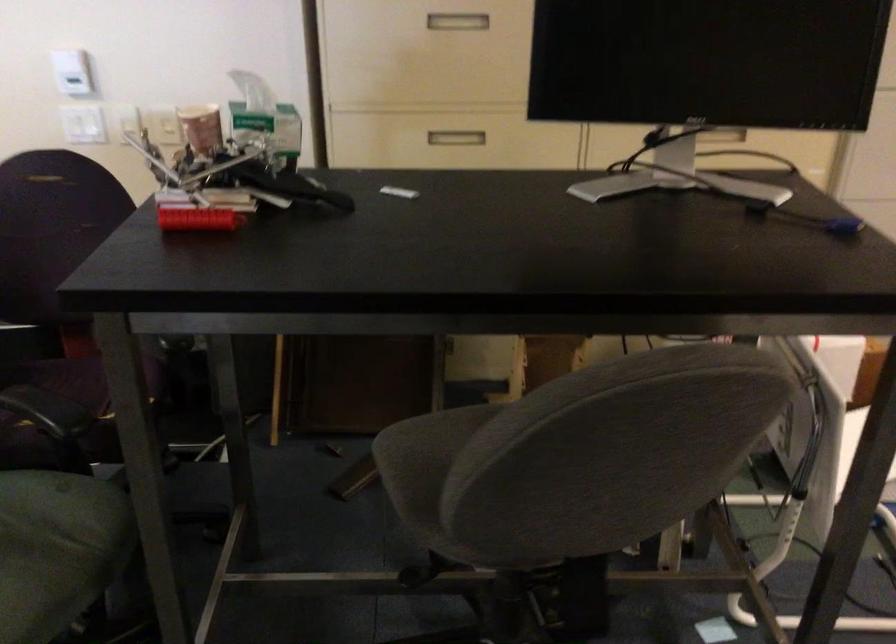
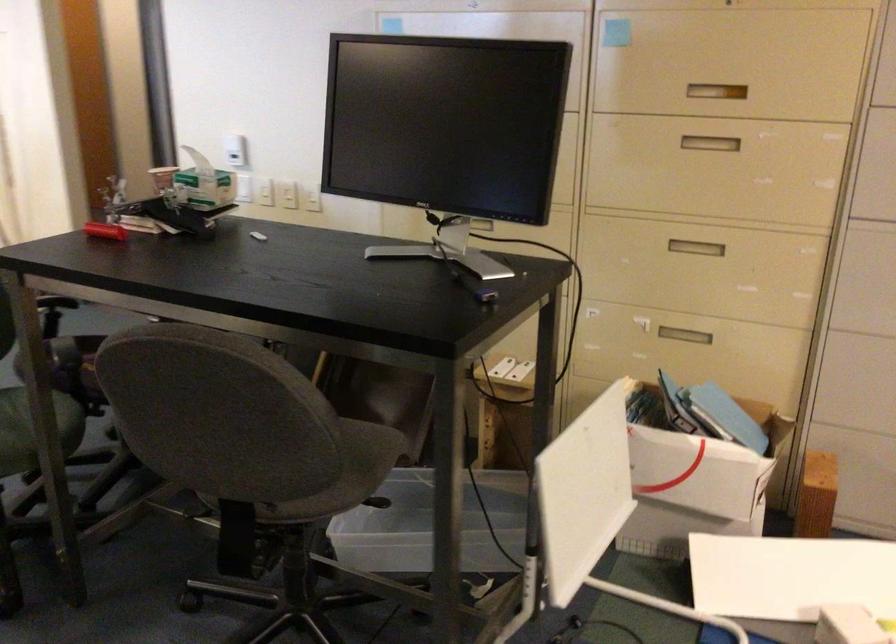
Locate, in the second image, the point that corresponds to point (200, 219) in the first image.

(104, 231)